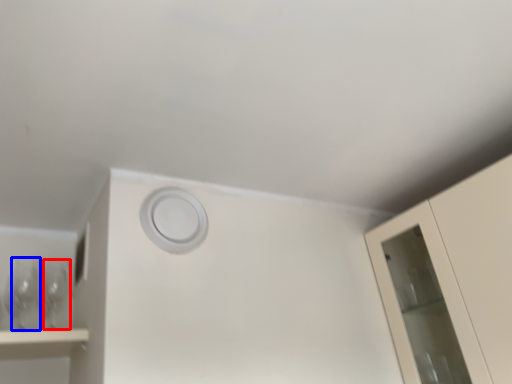
Question: Which object is closer to the camera taking this photo, wine glass (highlighted by a red box) or wine glass (highlighted by a blue box)?

Choices:
 (A) wine glass
 (B) wine glass

Answer: (B)